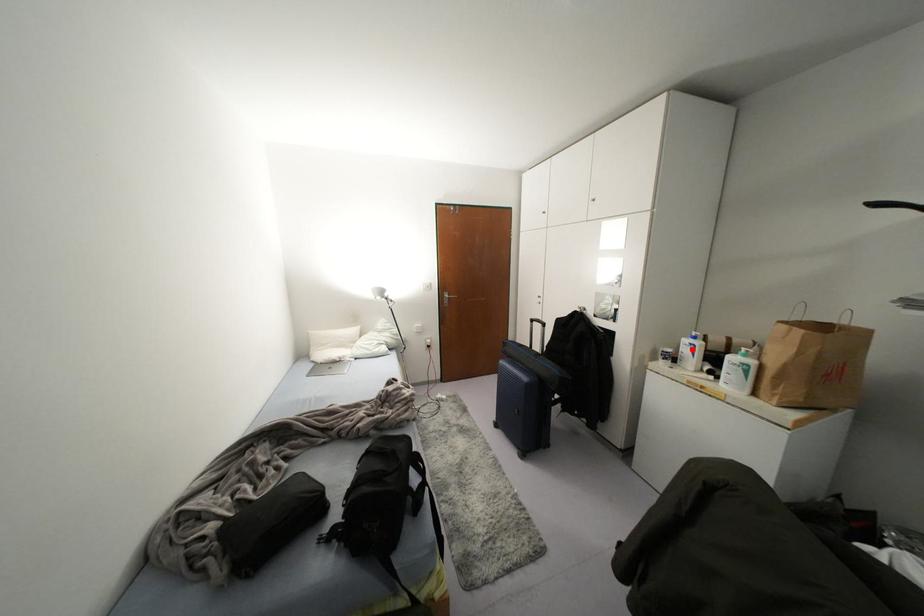
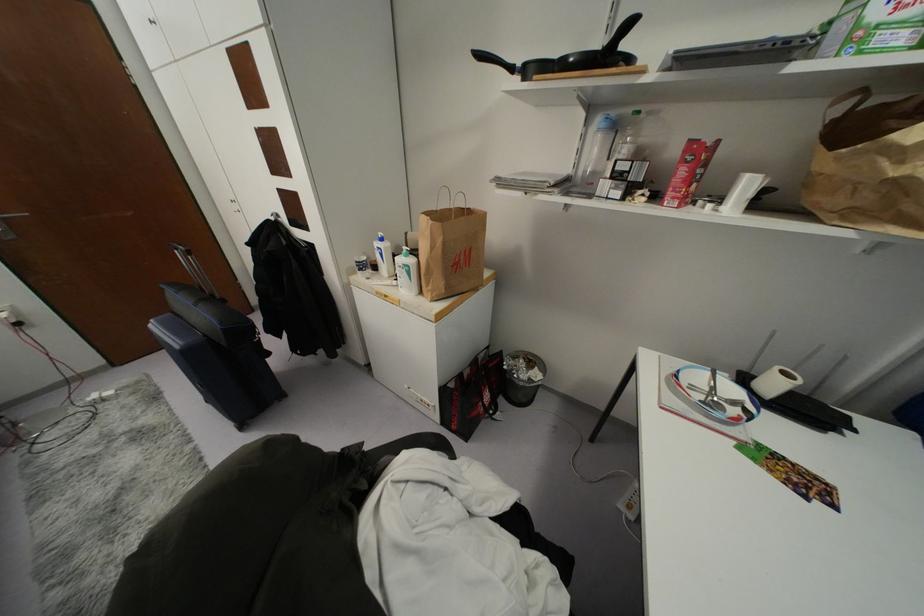
Where in the second image is the point corresponding to the highlighted location from the first image?

(381, 254)